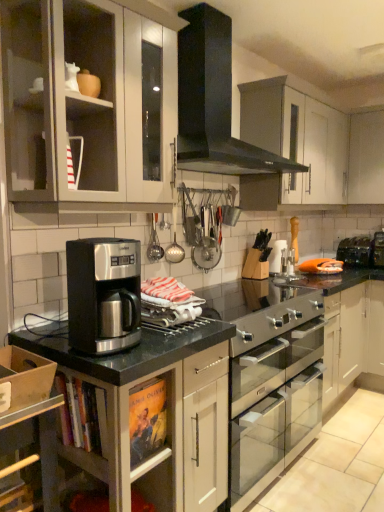
You are a GUI agent. You are given a task and a screenshot of the screen. Output one action in this format:
    pyautogui.click(x=<x>, y=<y>)
    Task: Click on the satin silver cabinet at lower left, the third cabinetry from the top
    
    Given the screenshot: What is the action you would take?
    pyautogui.click(x=156, y=433)

Find the location of `black matte gas stove at upper center`. black matte gas stove at upper center is located at coordinates (213, 102).

Locate an element on the screen. This screenshot has width=384, height=512. satin black coffee maker at center is located at coordinates (103, 294).

Consider the image. What is the approximate height of black metallic toaster at right, placed as the second appliance when sorted from left to right?

The height of black metallic toaster at right, placed as the second appliance when sorted from left to right, is 9.11 inches.

What do you see at coordinates (356, 251) in the screenshot? The image size is (384, 512). I see `black metallic toaster at right, acting as the second appliance starting from the bottom` at bounding box center [356, 251].

Identify the location of white matte cabinet at upper right, which ranks as the third cabinetry in left-to-right order. (366, 158).

Based on the photo, from a real-world perspective, does black metallic toaster at right, the 1th appliance when ordered from right to left, sit lower than black matte gas stove at upper center?

Yes, from a real-world perspective, black metallic toaster at right, the 1th appliance when ordered from right to left, is beneath black matte gas stove at upper center.

Does black metallic toaster at right, placed as the second appliance when sorted from left to right, have a lesser height compared to black matte gas stove at upper center?

Indeed, black metallic toaster at right, placed as the second appliance when sorted from left to right, has a lesser height compared to black matte gas stove at upper center.

Does point (353, 260) come closer to viewer compared to point (231, 55)?

That is False.

Is matte white cabinet at upper left, which is the 2th cabinetry in top-to-bottom order, facing towards black metallic toaster at right, the 2th appliance in the front-to-back sequence?

No, matte white cabinet at upper left, which is the 2th cabinetry in top-to-bottom order, is not turned towards black metallic toaster at right, the 2th appliance in the front-to-back sequence.

Is matte white cabinet at upper left, acting as the second cabinetry starting from the front, placed right next to black metallic toaster at right, acting as the second appliance starting from the bottom?

They are not placed beside each other.

From the black metallic toaster at right, the 1th appliance from the back, count 2nd cabinetrys forward and point to it. Please provide its 2D coordinates.

[(83, 100)]

Is matte white cabinet at upper left, which is the 3th cabinetry in right-to-left order, completely or partially outside of black metallic toaster at right, which is counted as the first appliance, starting from the top?

matte white cabinet at upper left, which is the 3th cabinetry in right-to-left order, lies outside black metallic toaster at right, which is counted as the first appliance, starting from the top,'s area.

Find the location of `cabinetry located below the black metallic toaster at right, the 1th appliance when ordered from right to left (from the image's perspective)`. cabinetry located below the black metallic toaster at right, the 1th appliance when ordered from right to left (from the image's perspective) is located at coordinates (156, 433).

How different are the orientations of satin silver cabinet at lower left, which appears as the second cabinetry when viewed from the right, and black metallic toaster at right, acting as the second appliance starting from the bottom, in degrees?

89.1 degrees.

Based on the photo, from a real-world perspective, between satin silver cabinet at lower left, the third cabinetry when ordered from back to front, and black metallic toaster at right, acting as the second appliance starting from the bottom, who is vertically higher?

In real-world perspective, black metallic toaster at right, acting as the second appliance starting from the bottom, is above.

Is matte white cabinet at upper left, which is the 2th cabinetry in top-to-bottom order, positioned beyond the bounds of satin silver cabinet at lower left, positioned as the 2th cabinetry in left-to-right order?

matte white cabinet at upper left, which is the 2th cabinetry in top-to-bottom order, is positioned outside satin silver cabinet at lower left, positioned as the 2th cabinetry in left-to-right order.

Which of these two, matte white cabinet at upper left, the 1th cabinetry positioned from the left, or satin silver cabinet at lower left, positioned as the 2th cabinetry in left-to-right order, stands shorter?

matte white cabinet at upper left, the 1th cabinetry positioned from the left, is shorter.

Considering the sizes of objects matte white cabinet at upper left, the 1th cabinetry positioned from the left, and satin silver cabinet at lower left, the third cabinetry from the top, in the image provided, who is wider, matte white cabinet at upper left, the 1th cabinetry positioned from the left, or satin silver cabinet at lower left, the third cabinetry from the top,?

Wider between the two is satin silver cabinet at lower left, the third cabinetry from the top.

From a real-world perspective, is black matte gas stove at upper center located higher than satin black coffee maker at center?

Yes.

Is point (190, 68) positioned in front of point (108, 304)?

That is False.

From the image's perspective, who appears lower, black matte gas stove at upper center or satin black coffee maker at center?

satin black coffee maker at center, from the image's perspective.

Looking at this image, is black matte gas stove at upper center facing away from satin black coffee maker at center?

black matte gas stove at upper center does not have its back to satin black coffee maker at center.

Between satin silver oven at center, positioned as the second appliance in back-to-front order, and black metallic toaster at right, which is counted as the first appliance, starting from the top, which one has smaller width?

Thinner between the two is black metallic toaster at right, which is counted as the first appliance, starting from the top.

Considering the sizes of objects satin silver oven at center, positioned as the second appliance in right-to-left order, and black metallic toaster at right, the 1th appliance when ordered from right to left, in the image provided, who is smaller, satin silver oven at center, positioned as the second appliance in right-to-left order, or black metallic toaster at right, the 1th appliance when ordered from right to left,?

Smaller between the two is black metallic toaster at right, the 1th appliance when ordered from right to left.

Considering the positions of objects satin silver oven at center, positioned as the second appliance in top-to-bottom order, and black metallic toaster at right, the 1th appliance when ordered from right to left, in the image provided, who is more to the right, satin silver oven at center, positioned as the second appliance in top-to-bottom order, or black metallic toaster at right, the 1th appliance when ordered from right to left,?

black metallic toaster at right, the 1th appliance when ordered from right to left, is more to the right.

Can you tell me how much satin silver oven at center, which is the 1th appliance in left-to-right order, and black metallic toaster at right, acting as the second appliance starting from the bottom, differ in facing direction?

89.2 degrees.

From the image's perspective, is matte white cabinet at upper left, which is the 2th cabinetry in top-to-bottom order, on black matte gas stove at upper center?

Incorrect, from the image's perspective, matte white cabinet at upper left, which is the 2th cabinetry in top-to-bottom order, is lower than black matte gas stove at upper center.

Which is behind, point (16, 177) or point (188, 18)?

The point (188, 18) is farther from the camera.

Image resolution: width=384 pixels, height=512 pixels. Find the location of `the 1st appliance below when counting from the black matte gas stove at upper center (from the image's perspective)`. the 1st appliance below when counting from the black matte gas stove at upper center (from the image's perspective) is located at coordinates [356, 251].

You are a GUI agent. You are given a task and a screenshot of the screen. Output one action in this format:
    pyautogui.click(x=<x>, y=<y>)
    Task: Click on the cabinetry that is the 2nd object to the left of the black metallic toaster at right, which is counted as the first appliance, starting from the top, starting at the anchor
    This screenshot has width=384, height=512.
    Given the screenshot: What is the action you would take?
    pyautogui.click(x=83, y=100)

From the image, which object appears to be nearer to satin silver oven at center, positioned as the second appliance in back-to-front order, white matte cabinet at upper right, which is the 1th cabinetry in right-to-left order, or black metallic toaster at right, the 1th appliance when ordered from right to left?

black metallic toaster at right, the 1th appliance when ordered from right to left, is positioned closer to the anchor satin silver oven at center, positioned as the second appliance in back-to-front order.

Which object lies further to the anchor point white matte cabinet at upper right, which ranks as the third cabinetry in left-to-right order, satin silver oven at center, positioned as the second appliance in right-to-left order, or satin silver cabinet at lower left, the third cabinetry from the top?

Among the two, satin silver cabinet at lower left, the third cabinetry from the top, is located further to white matte cabinet at upper right, which ranks as the third cabinetry in left-to-right order.

Considering their positions, is black metallic toaster at right, the 2th appliance in the front-to-back sequence, positioned further to black matte gas stove at upper center than satin silver oven at center, which is the 1th appliance in left-to-right order?

black metallic toaster at right, the 2th appliance in the front-to-back sequence, is further to black matte gas stove at upper center.

Which object lies nearer to the anchor point matte white cabinet at upper left, arranged as the second cabinetry when viewed from the back, satin silver oven at center, positioned as the second appliance in back-to-front order, or satin black coffee maker at center?

satin black coffee maker at center is positioned closer to the anchor matte white cabinet at upper left, arranged as the second cabinetry when viewed from the back.

From the image, which object appears to be nearer to black metallic toaster at right, the 2th appliance in the front-to-back sequence, satin silver oven at center, which is the 1th appliance in left-to-right order, or white matte cabinet at upper right, the first cabinetry positioned from the back?

Based on the image, white matte cabinet at upper right, the first cabinetry positioned from the back, appears to be nearer to black metallic toaster at right, the 2th appliance in the front-to-back sequence.

Considering their positions, is satin black coffee maker at center positioned closer to white matte cabinet at upper right, the 1th cabinetry positioned from the top, than black metallic toaster at right, acting as the second appliance starting from the bottom?

Among the two, black metallic toaster at right, acting as the second appliance starting from the bottom, is located nearer to white matte cabinet at upper right, the 1th cabinetry positioned from the top.

Based on their spatial positions, is matte white cabinet at upper left, arranged as the second cabinetry when viewed from the back, or white matte cabinet at upper right, the 1th cabinetry positioned from the top, further from satin black coffee maker at center?

white matte cabinet at upper right, the 1th cabinetry positioned from the top, is further to satin black coffee maker at center.

Looking at the image, which one is located further to satin black coffee maker at center, white matte cabinet at upper right, the first cabinetry positioned from the back, or black matte gas stove at upper center?

The object further to satin black coffee maker at center is white matte cabinet at upper right, the first cabinetry positioned from the back.

The width and height of the screenshot is (384, 512). I want to click on kitchen appliance positioned between satin silver cabinet at lower left, the third cabinetry from the top, and black metallic toaster at right, which is counted as the first appliance, starting from the top, from near to far, so click(103, 294).

What are the coordinates of `appliance positioned between satin black coffee maker at center and black metallic toaster at right, acting as the second appliance starting from the bottom, from near to far` in the screenshot? It's located at (260, 310).

This screenshot has height=512, width=384. I want to click on appliance located between black matte gas stove at upper center and black metallic toaster at right, the 1th appliance from the back, in the depth direction, so click(x=260, y=310).

At what (x,y) coordinates should I click in order to perform the action: click on gas stove located between satin silver cabinet at lower left, the 1th cabinetry in the bottom-to-top sequence, and white matte cabinet at upper right, the 1th cabinetry positioned from the top, in the depth direction. Please return your answer as a coordinate pair (x, y). Image resolution: width=384 pixels, height=512 pixels. Looking at the image, I should click on coord(213,102).